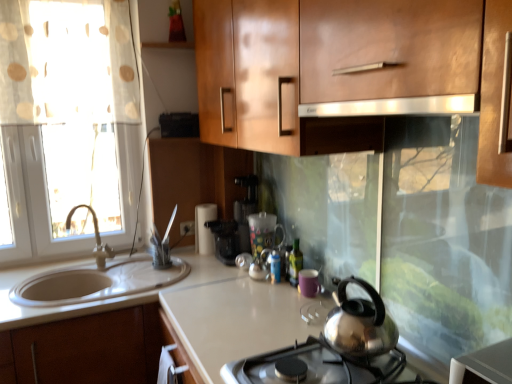
Where is `vacant space in front of white matte paper towel holder at center, the 3th appliance viewed from the right`? The image size is (512, 384). vacant space in front of white matte paper towel holder at center, the 3th appliance viewed from the right is located at coordinates (210, 265).